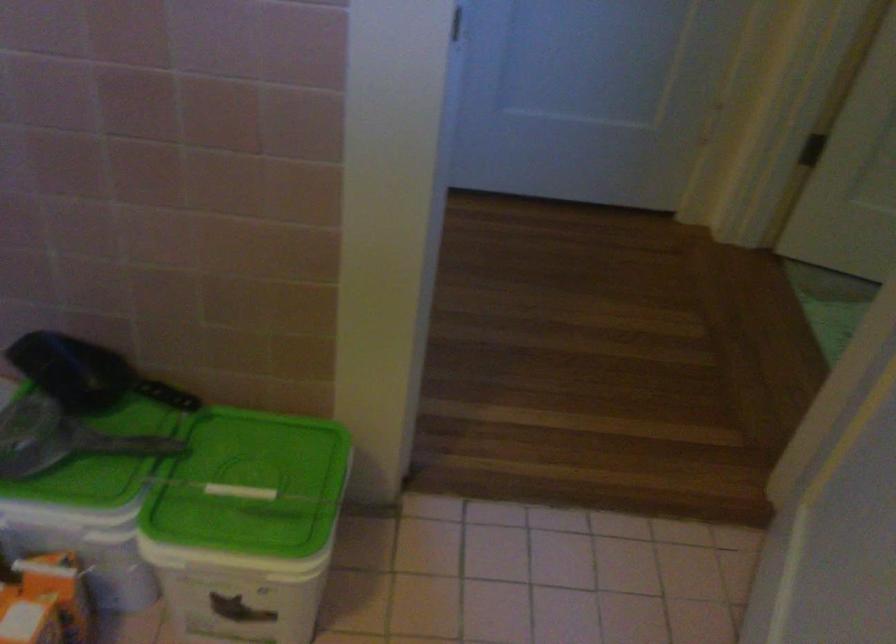
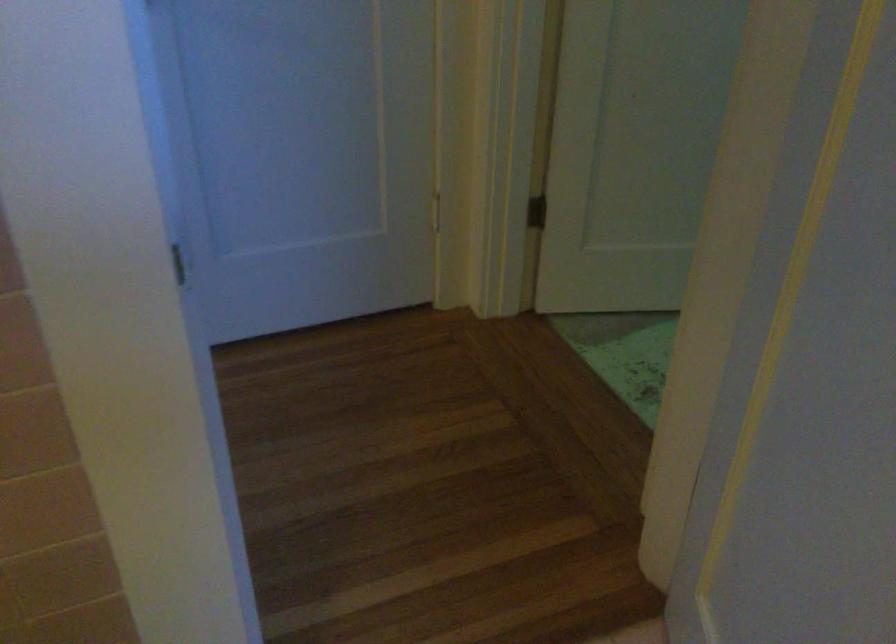
Question: What movement of the cameraman would produce the second image?

Choices:
 (A) Left
 (B) Right
 (C) Forward
 (D) Backward

Answer: (C)